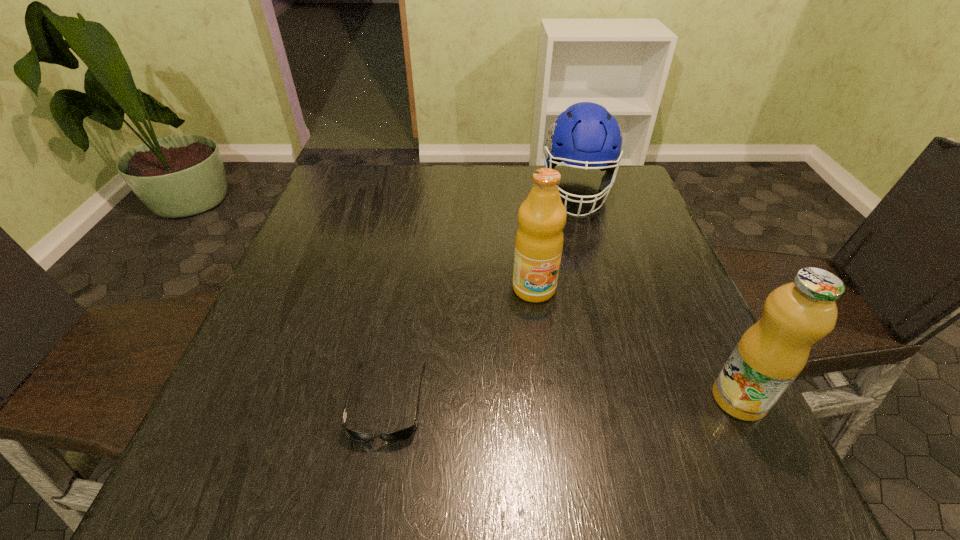
Locate an element on the screen. This screenshot has width=960, height=540. vacant area located 0.230m on the front label of the second object from left to right is located at coordinates (566, 401).

Where is `free location located 0.280m on the face guard of the third tallest object`? This screenshot has height=540, width=960. free location located 0.280m on the face guard of the third tallest object is located at coordinates click(x=585, y=299).

Identify the location of free location located on the face guard of the third tallest object. (583, 271).

The height and width of the screenshot is (540, 960). Identify the location of free spot located on the face guard of the third tallest object. pyautogui.click(x=588, y=332).

This screenshot has width=960, height=540. What are the coordinates of `object situated at the far edge` in the screenshot? It's located at (585, 134).

The image size is (960, 540). Find the location of `sunglasses that is at the near edge`. sunglasses that is at the near edge is located at coordinates (403, 434).

Image resolution: width=960 pixels, height=540 pixels. Find the location of `fruit juice that is at the near edge`. fruit juice that is at the near edge is located at coordinates (x=769, y=356).

The width and height of the screenshot is (960, 540). I want to click on fruit juice that is at the right edge, so [x=769, y=356].

Find the location of a particular element. football helmet positioned at the right edge is located at coordinates (585, 134).

I want to click on object present at the far right corner, so click(585, 134).